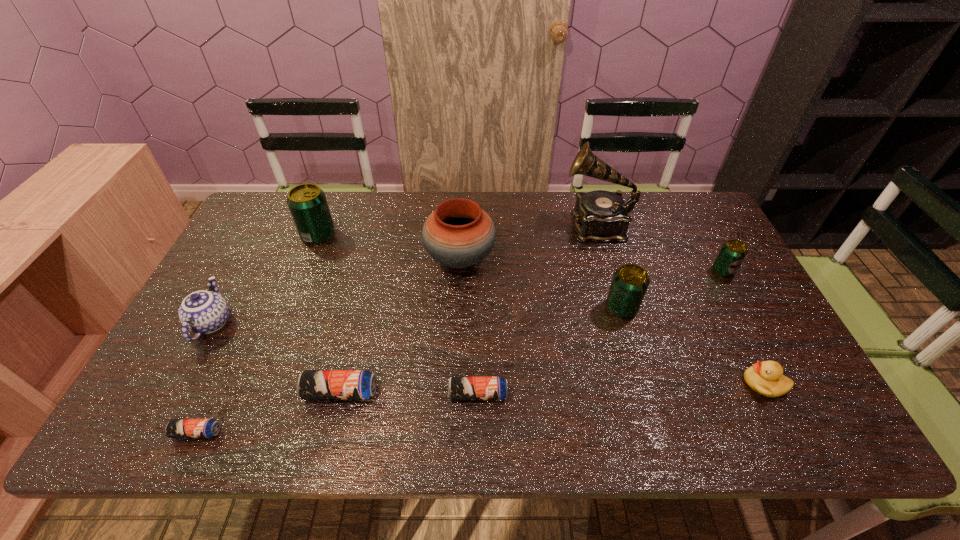
At what (x,y) coordinates should I click in order to perform the action: click on the third shortest beer can. Please return your answer as a coordinate pair (x, y). This screenshot has width=960, height=540. Looking at the image, I should click on (312, 384).

The image size is (960, 540). I want to click on the second blue beer can from left to right, so click(312, 384).

Locate an element on the screen. the fourth beer can from left to right is located at coordinates (459, 388).

Where is `the second biggest blue beer can`? the second biggest blue beer can is located at coordinates (459, 388).

You are a GUI agent. You are given a task and a screenshot of the screen. Output one action in this format:
    pyautogui.click(x=<x>, y=<y>)
    Task: Click on the shortest object
    The width and height of the screenshot is (960, 540).
    Given the screenshot: What is the action you would take?
    pyautogui.click(x=176, y=428)

Locate an element on the screen. the leftmost blue beer can is located at coordinates (176, 428).

Where is `free space located 0.400m on the horn of the phonograph record`? This screenshot has height=540, width=960. free space located 0.400m on the horn of the phonograph record is located at coordinates (440, 225).

This screenshot has height=540, width=960. What are the coordinates of `blank space located 0.310m on the horn of the phonograph record` in the screenshot? It's located at (468, 225).

Where is `vacant space located 0.170m on the horn of the phonograph record`? The width and height of the screenshot is (960, 540). vacant space located 0.170m on the horn of the phonograph record is located at coordinates [511, 225].

This screenshot has width=960, height=540. I want to click on free space located on the right of the red pottery, so click(594, 258).